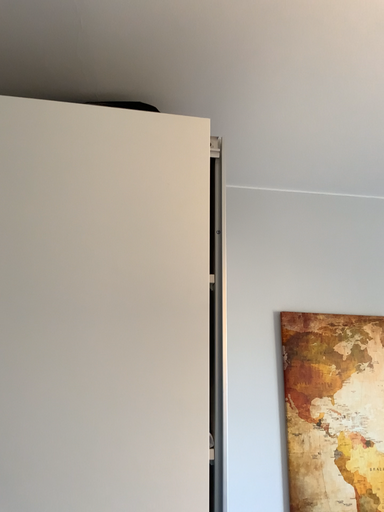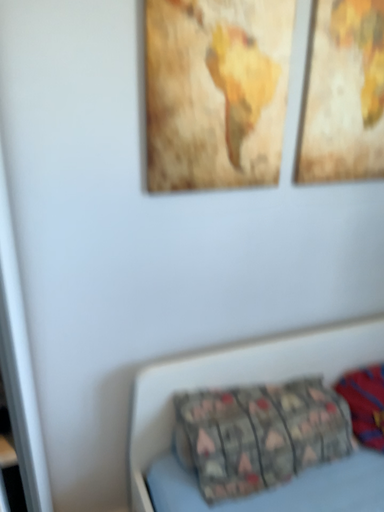
Question: Which way did the camera rotate in the video?

Choices:
 (A) rotated right
 (B) rotated left

Answer: (A)